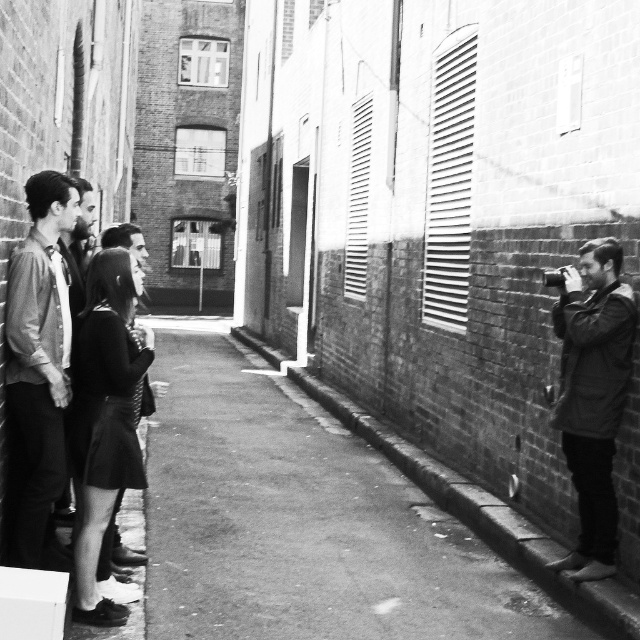
Looking at this image, you are standing at the point marked as point (593, 396) in the image. Looking around, you see a dark gray coat at right. What direction should you face to see the dark gray coat at right?

You should face to the right to see the dark gray coat at right as it is located at the right side of the point (593, 396).

You are a delivery person trying to navigate through the alleyway. You see the dark gray coat at right and the smooth concrete curb at lower right. Which object is taller, and how does this affect your path?

The dark gray coat at right is taller than the smooth concrete curb at lower right. Since the coat is taller, you should be cautious of its height when moving through the alley to avoid collisions, while the curb, being lower, might not obstruct your path as much.